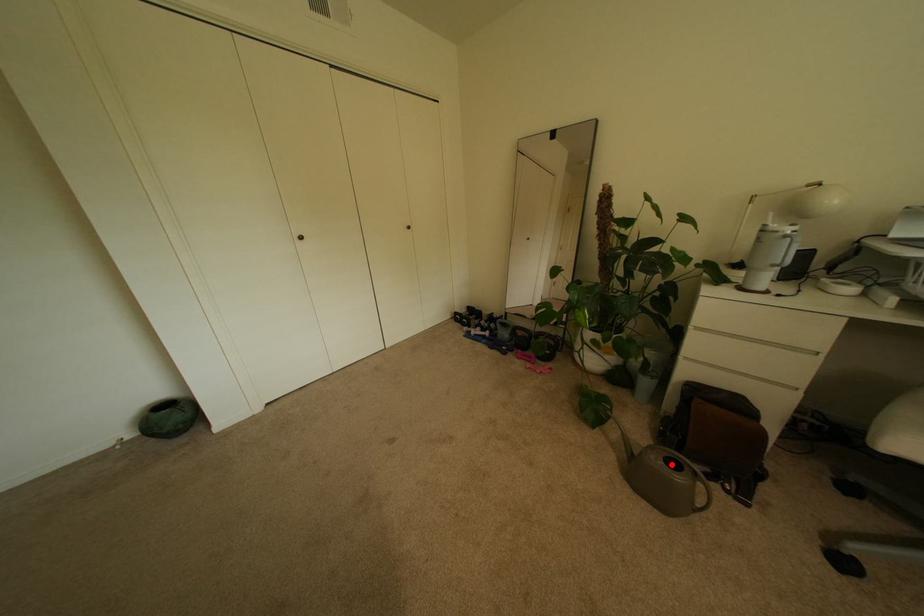
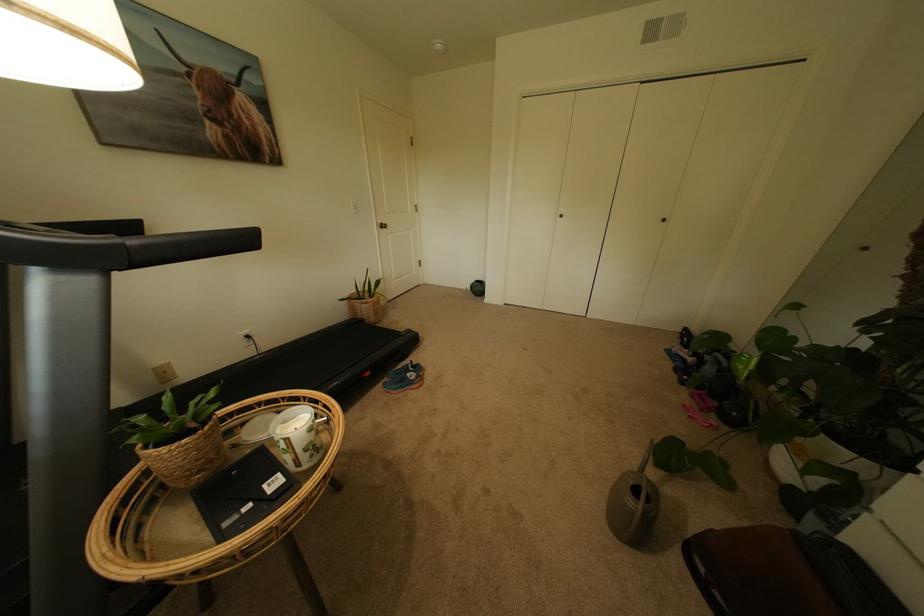
Question: I am providing you with two images of the same scene from different viewpoints. In image1, a red point is highlighted. Considering the same 3D point in image2, which of the following is correct?

Choices:
 (A) It is closer
 (B) It is farther

Answer: (A)